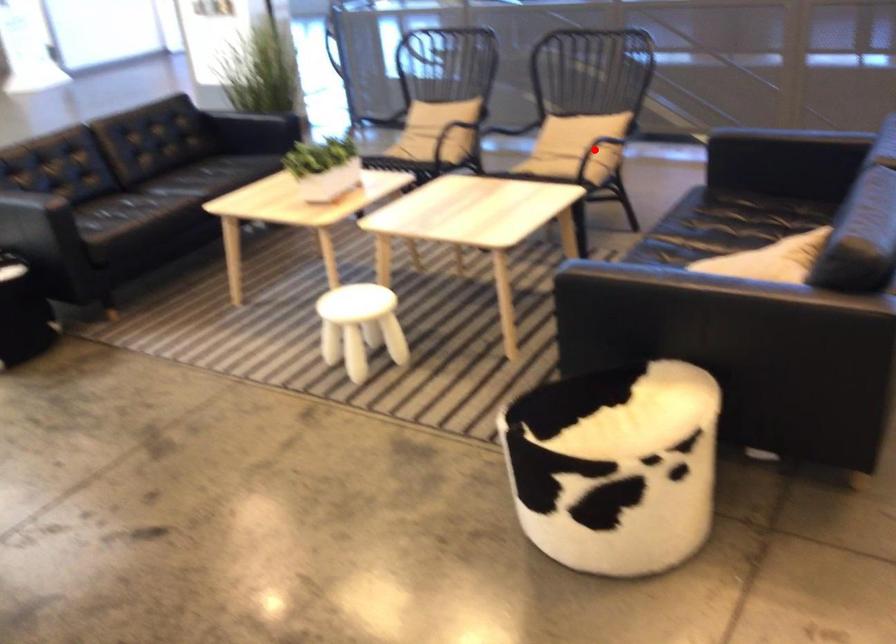
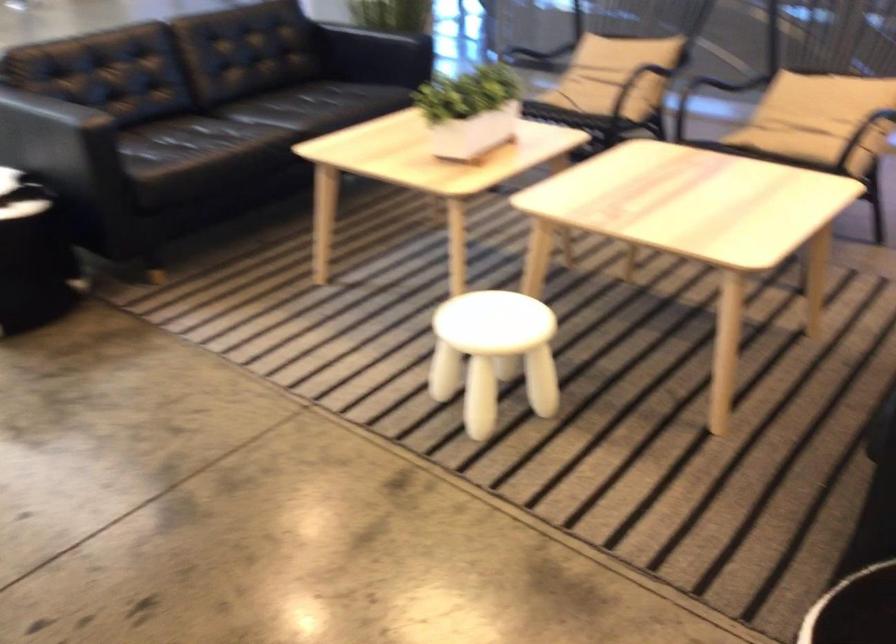
The point at the highlighted location is marked in the first image. Where is the corresponding point in the second image?

(866, 128)